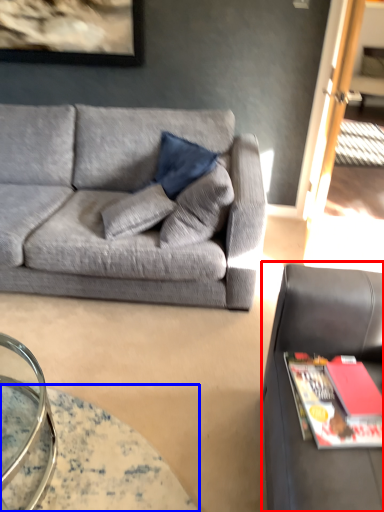
Question: Among these objects, which one is nearest to the camera, studio couch (highlighted by a red box) or table (highlighted by a blue box)?

Choices:
 (A) studio couch
 (B) table

Answer: (A)